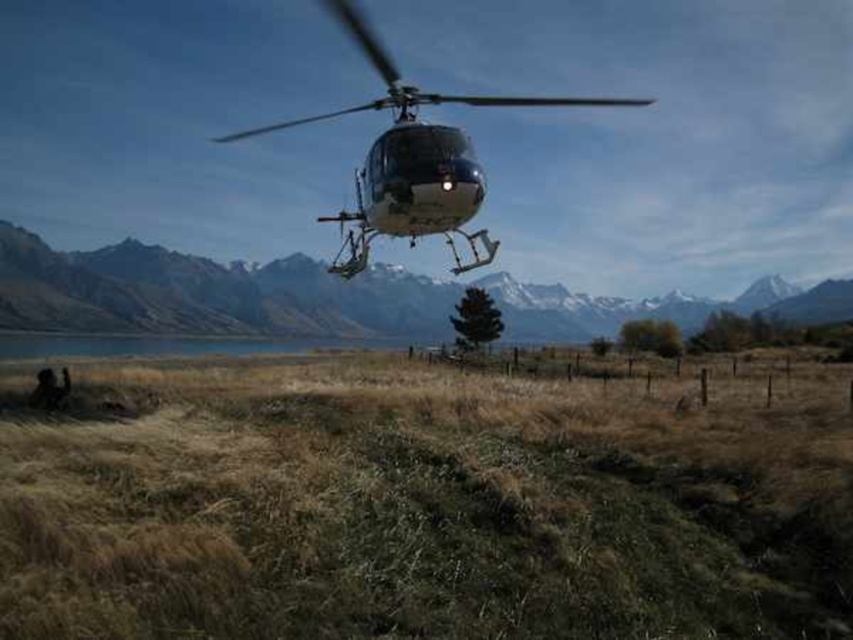
Question: Which point is closer to the camera?

Choices:
 (A) (421, 212)
 (B) (201, 298)
 (C) (107, 428)

Answer: (C)

Question: Which of the following is the farthest from the observer?

Choices:
 (A) matte gray helicopter at upper center
 (B) metallic silver helicopter at center

Answer: (A)

Question: Can you confirm if dry grass at lower left is positioned below metallic silver helicopter at center?

Choices:
 (A) yes
 (B) no

Answer: (A)

Question: Does dry grass at lower left come behind metallic silver helicopter at center?

Choices:
 (A) no
 (B) yes

Answer: (A)

Question: Among these objects, which one is farthest from the camera?

Choices:
 (A) metallic silver helicopter at center
 (B) matte gray helicopter at upper center

Answer: (B)

Question: Is dry grass at lower left further to the viewer compared to metallic silver helicopter at center?

Choices:
 (A) no
 (B) yes

Answer: (A)